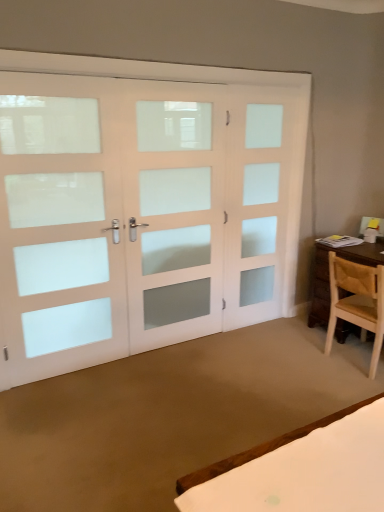
Question: Should I look upward or downward to see light brown wooden chair at right?

Choices:
 (A) up
 (B) down

Answer: (B)

Question: From a real-world perspective, is white frosted glass door at center, placed as the second screen door when sorted from left to right, over light brown wooden chair at right?

Choices:
 (A) no
 (B) yes

Answer: (B)

Question: Is white frosted glass door at center, placed as the second screen door when sorted from left to right, at the right side of light brown wooden chair at right?

Choices:
 (A) yes
 (B) no

Answer: (B)

Question: Considering the relative sizes of white frosted glass door at center, which ranks as the 2th screen door in right-to-left order, and light brown wooden chair at right in the image provided, is white frosted glass door at center, which ranks as the 2th screen door in right-to-left order, thinner than light brown wooden chair at right?

Choices:
 (A) yes
 (B) no

Answer: (A)

Question: Considering the relative sizes of white frosted glass door at center, which ranks as the 2th screen door in right-to-left order, and light brown wooden chair at right in the image provided, is white frosted glass door at center, which ranks as the 2th screen door in right-to-left order, taller than light brown wooden chair at right?

Choices:
 (A) no
 (B) yes

Answer: (B)

Question: Does white frosted glass door at center, which ranks as the 2th screen door in right-to-left order, turn towards light brown wooden chair at right?

Choices:
 (A) yes
 (B) no

Answer: (B)

Question: Is white frosted glass door at center, placed as the second screen door when sorted from left to right, directly adjacent to light brown wooden chair at right?

Choices:
 (A) yes
 (B) no

Answer: (B)

Question: From the image's perspective, is light brown wooden chair at right on white frosted glass door at left, positioned as the third screen door in right-to-left order?

Choices:
 (A) yes
 (B) no

Answer: (B)

Question: Is white frosted glass door at left, the first screen door from the left, completely or partially inside light brown wooden chair at right?

Choices:
 (A) no
 (B) yes

Answer: (A)

Question: Can you confirm if light brown wooden chair at right is thinner than white frosted glass door at left, the first screen door from the left?

Choices:
 (A) yes
 (B) no

Answer: (B)

Question: Is light brown wooden chair at right aimed at white frosted glass door at left, positioned as the third screen door in right-to-left order?

Choices:
 (A) no
 (B) yes

Answer: (A)

Question: From a real-world perspective, is light brown wooden chair at right physically below white frosted glass door at left, the first screen door from the left?

Choices:
 (A) no
 (B) yes

Answer: (B)

Question: Is light brown wooden chair at right not within white frosted glass door at left, positioned as the third screen door in right-to-left order?

Choices:
 (A) yes
 (B) no

Answer: (A)

Question: Is white frosted glass door at center, which ranks as the 2th screen door in right-to-left order, inside white frosted glass door at left, positioned as the third screen door in right-to-left order?

Choices:
 (A) no
 (B) yes

Answer: (A)